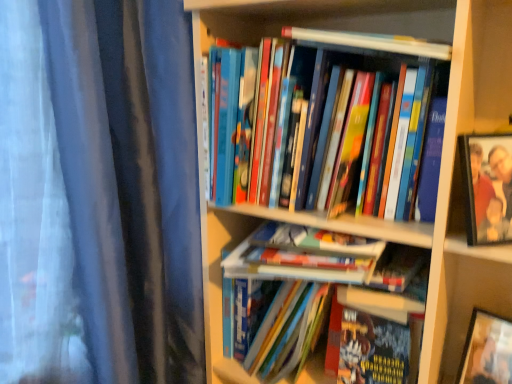
Question: Is hardcover book at upper center, the sixth book positioned from the bottom, facing away from hardcover book at center, the 1th book in the bottom-to-top sequence?

Choices:
 (A) no
 (B) yes

Answer: (A)

Question: From a real-world perspective, is hardcover book at upper center, which appears as the 1th book when viewed from the top, located higher than hardcover book at center, the 6th book from the top?

Choices:
 (A) yes
 (B) no

Answer: (A)

Question: From the image's perspective, is hardcover book at upper center, the sixth book positioned from the bottom, located beneath hardcover book at center, the 6th book from the top?

Choices:
 (A) yes
 (B) no

Answer: (B)

Question: Can we say hardcover book at upper center, which appears as the 1th book when viewed from the top, lies outside hardcover book at center, the 6th book from the top?

Choices:
 (A) yes
 (B) no

Answer: (A)

Question: Does hardcover book at upper center, the sixth book positioned from the bottom, have a smaller size compared to hardcover book at center, the 6th book from the top?

Choices:
 (A) no
 (B) yes

Answer: (B)

Question: Can you confirm if hardcover book at upper center, which appears as the 1th book when viewed from the top, is positioned to the left of hardcover book at center, the 6th book from the top?

Choices:
 (A) no
 (B) yes

Answer: (B)

Question: Can you confirm if hardcover book at center, the 3th book from the top, is shorter than hardcover book at center, placed as the fifth book when sorted from top to bottom?

Choices:
 (A) yes
 (B) no

Answer: (A)

Question: Would you say hardcover book at center, the 3th book from the top, is outside hardcover book at center, placed as the fifth book when sorted from top to bottom?

Choices:
 (A) yes
 (B) no

Answer: (A)

Question: From a real-world perspective, does hardcover book at center, the 3th book from the top, stand above hardcover book at center, placed as the fifth book when sorted from top to bottom?

Choices:
 (A) yes
 (B) no

Answer: (A)

Question: Is hardcover book at center, the 4th book positioned from the bottom, taller than hardcover book at center, placed as the fifth book when sorted from top to bottom?

Choices:
 (A) no
 (B) yes

Answer: (A)

Question: Can you confirm if hardcover book at center, the 4th book positioned from the bottom, is thinner than hardcover book at center, which is the 2th book in bottom-to-top order?

Choices:
 (A) no
 (B) yes

Answer: (B)

Question: Could you tell me if hardcover book at center, the 3th book from the top, is turned towards hardcover book at center, which is the 2th book in bottom-to-top order?

Choices:
 (A) yes
 (B) no

Answer: (B)

Question: Is wooden bookshelf at center next to hardcover books at center, the fourth book positioned from the top, and touching it?

Choices:
 (A) yes
 (B) no

Answer: (B)